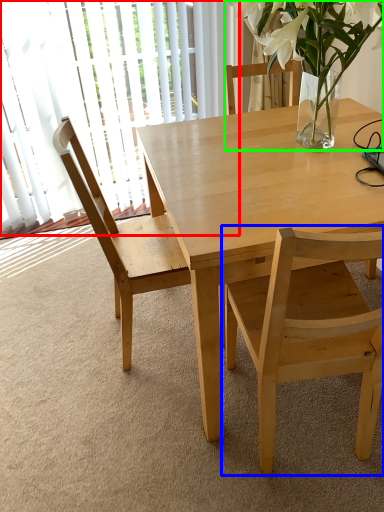
Question: Based on their relative distances, which object is nearer to glass door (highlighted by a red box)? Choose from chair (highlighted by a blue box) and houseplant (highlighted by a green box).

Choices:
 (A) chair
 (B) houseplant

Answer: (B)